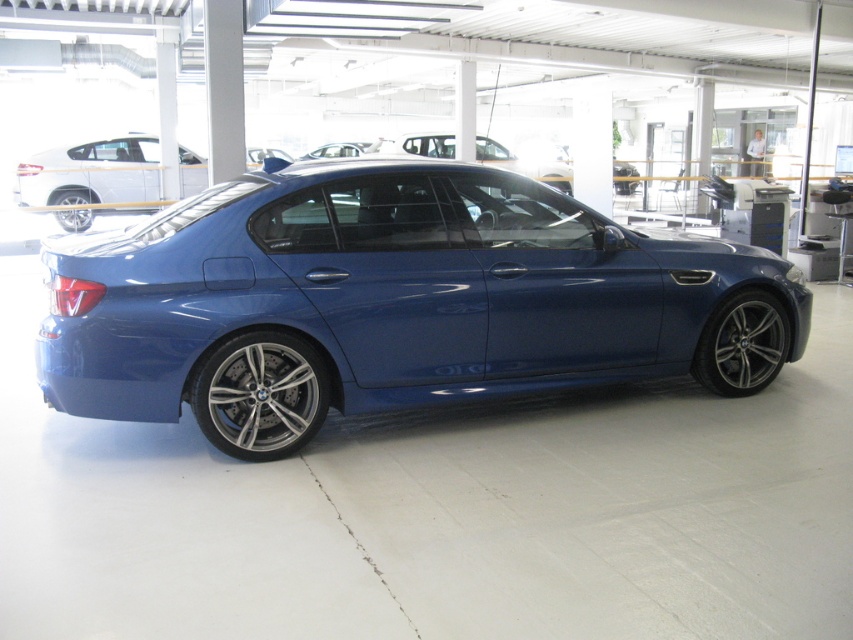
You are a delivery person needing to place a box between the polished aluminum wheel at lower center and the polished silver wheel at lower right. The box is 8 feet long. Can you fit the box between them without moving the wheels?

The distance between the polished aluminum wheel at lower center and the polished silver wheel at lower right is 8.43 feet. Since the box is 8 feet long, it can fit between them as the space is slightly larger than the box.

You are standing in the showroom and want to take a photo of the BMW car. You notice two points on the car, one at coordinate point [265,456] and another at point [280,403]. Which point will appear larger in your camera view?

Point [265,456] is closer to the camera than point [280,403], so it will appear larger in the camera view.

In the scene shown: You are standing at the entrance of the showroom and want to approach the glossy metallic car at center. The showroom has a coordinate system where the entrance is at point 0.0. The car is located at point 0.469. If you walk straight towards the car, will you reach it before reaching point 0.5?

The glossy metallic car at center is located at point 0.469, which is before point 0.5. Therefore, you will reach the glossy metallic car at center before reaching point 0.5.